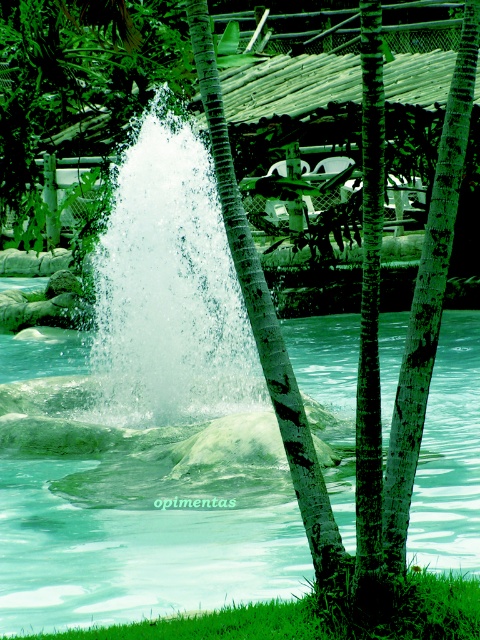
In the scene shown: You are a lifeguard standing at the edge of the clear water pool at center and the white frothy water at center. You need to throw a rescue buoy to someone in the water. Which area would you aim for to ensure the buoy reaches the person safely?

The clear water pool at center is wider than the white frothy water at center, so aiming for the clear water pool at center would provide a safer and more stable path for the rescue buoy to reach the person.

You are standing at the edge of the fountain in the middle ground of the scene. There is a clear water pool at center marked by point [140,540]. If you want to walk to the clear water pool at center, which direction should you move relative to the fountain?

The clear water pool at center is marked by point [140,540], so you should move towards the center of the fountain to reach it.

You are a lifeguard at a tropical resort and need to know the water levels in the fountain area. Which part of the water is lower in height between the clear water pool at center and the white frothy water at center?

The clear water pool at center has a lesser height compared to the white frothy water at center, so the clear water pool at center is lower in height.